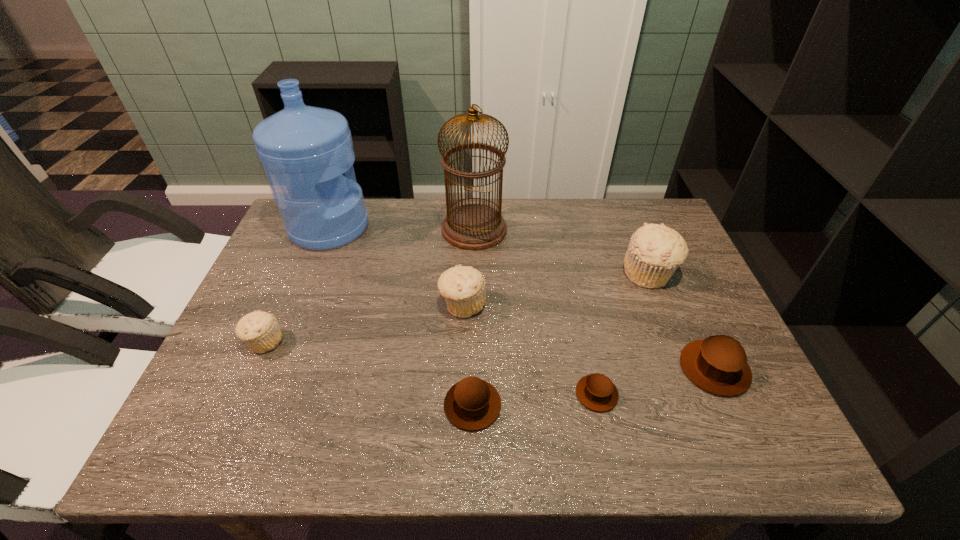
Locate an element on the screen. The image size is (960, 540). free space located 0.130m on the right of the third muffin from right to left is located at coordinates (679, 394).

Where is `water jug located at the far edge`? This screenshot has height=540, width=960. water jug located at the far edge is located at coordinates (304, 150).

Locate an element on the screen. Image resolution: width=960 pixels, height=540 pixels. birdcage at the far edge is located at coordinates (472, 226).

Locate an element on the screen. Image resolution: width=960 pixels, height=540 pixels. object situated at the near edge is located at coordinates (472, 404).

Identify the location of water jug positioned at the left edge. (304, 150).

Locate an element on the screen. muffin situated at the left edge is located at coordinates (259, 330).

Where is `object situated at the far left corner`? Image resolution: width=960 pixels, height=540 pixels. object situated at the far left corner is located at coordinates (304, 150).

Identify the location of free point at the far edge. (612, 240).

At what (x,y) coordinates should I click in order to perform the action: click on blank space at the near edge of the desktop. Please return your answer as a coordinate pair (x, y). Looking at the image, I should click on (627, 449).

You are a GUI agent. You are given a task and a screenshot of the screen. Output one action in this format:
    pyautogui.click(x=<x>, y=<y>)
    Task: Click on the vacant space at the left edge of the desktop
    
    Given the screenshot: What is the action you would take?
    pyautogui.click(x=214, y=416)